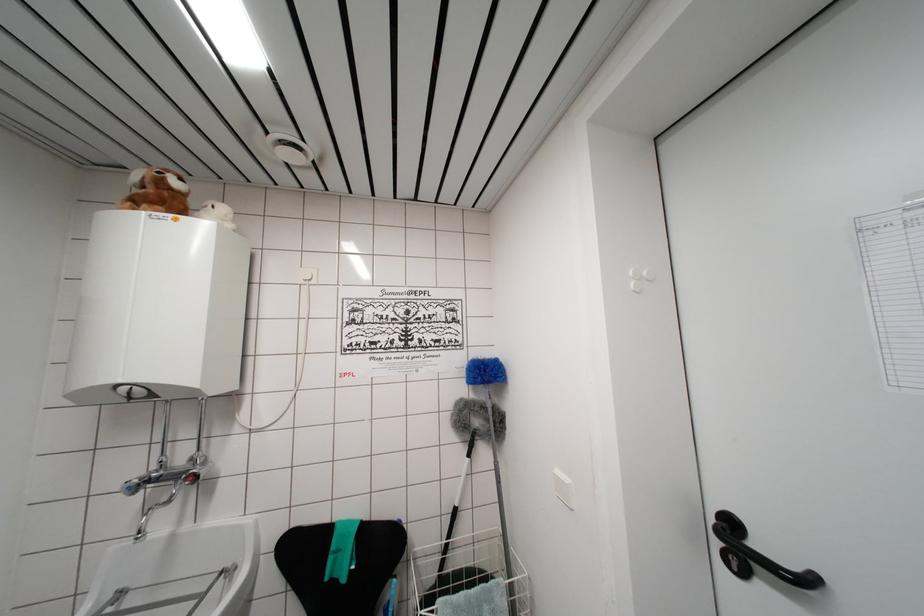
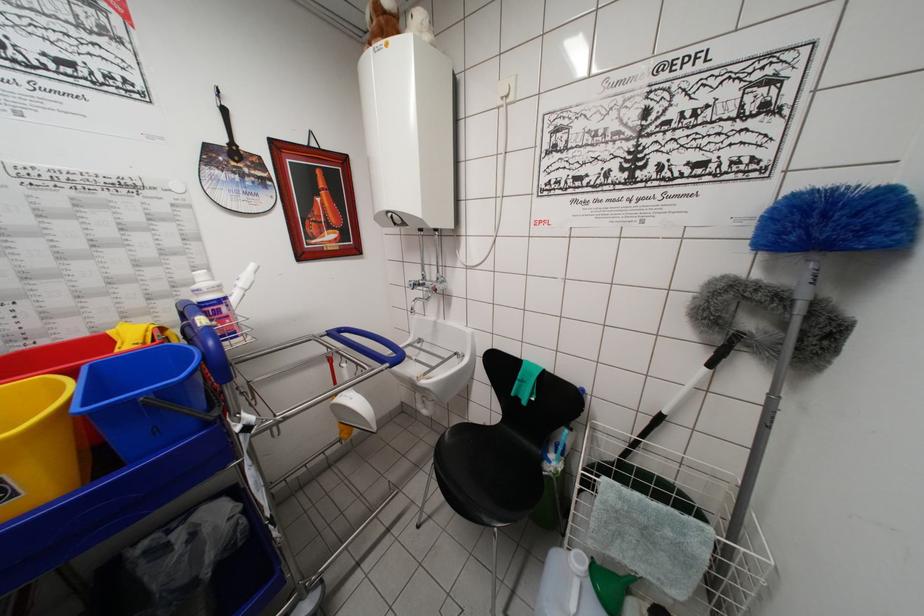
Find the pixel in the second image that matches pixel 455 516 in the first image.

(658, 419)